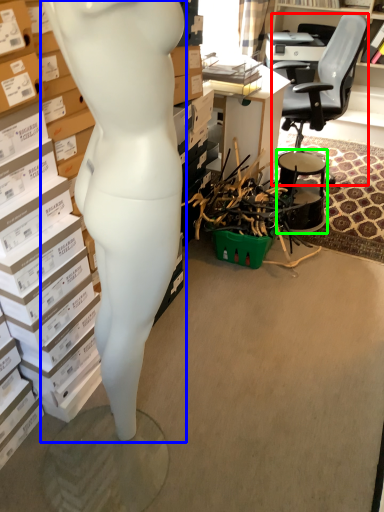
Question: Estimate the real-world distances between objects in this image. Which object is farther from chair (highlighted by a red box), person (highlighted by a blue box) or drum (highlighted by a green box)?

Choices:
 (A) person
 (B) drum

Answer: (A)